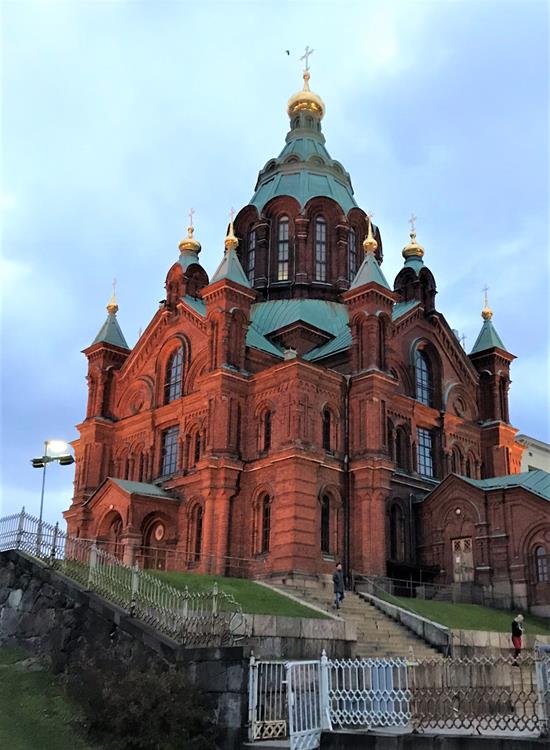
You are a GUI agent. You are given a task and a screenshot of the screen. Output one action in this format:
    pyautogui.click(x=<x>, y=<y>)
    Task: Click on the stairs
    
    Given the screenshot: What is the action you would take?
    pyautogui.click(x=371, y=620)